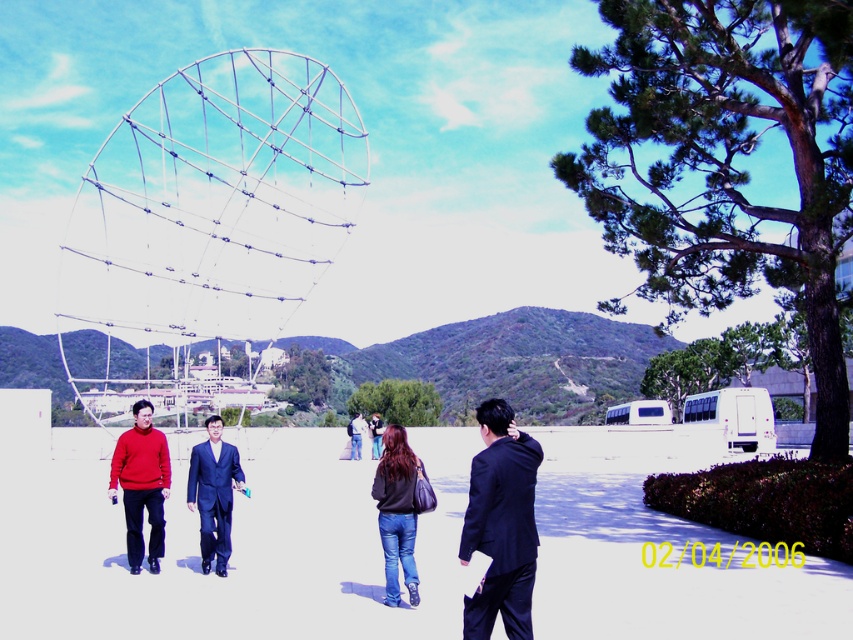
You are a photographer trying to capture both the black suit at center and the blue suit at center in a single frame. Which person should you focus on first to ensure both are in the shot?

The black suit at center is taller than the blue suit at center, so you should focus on the black suit at center first to ensure both are in the shot.

You are standing at the point marked by the coordinates point (502,524) in the image. Which object are you currently standing on?

The point (502,524) is on black suit at center, so you are standing on the black suit at center.

You are a photographer trying to capture both the black suit at center and the dark blue suit at center in a single frame. Given that your camera has a fixed focal length, which person should you position closer to the camera to ensure both are fully visible?

Since the black suit at center is wider than the dark blue suit at center, you should position the black suit at center closer to the camera. This way, its larger width will occupy more of the frame, allowing the narrower dark blue suit at center to fit alongside within the camera view.